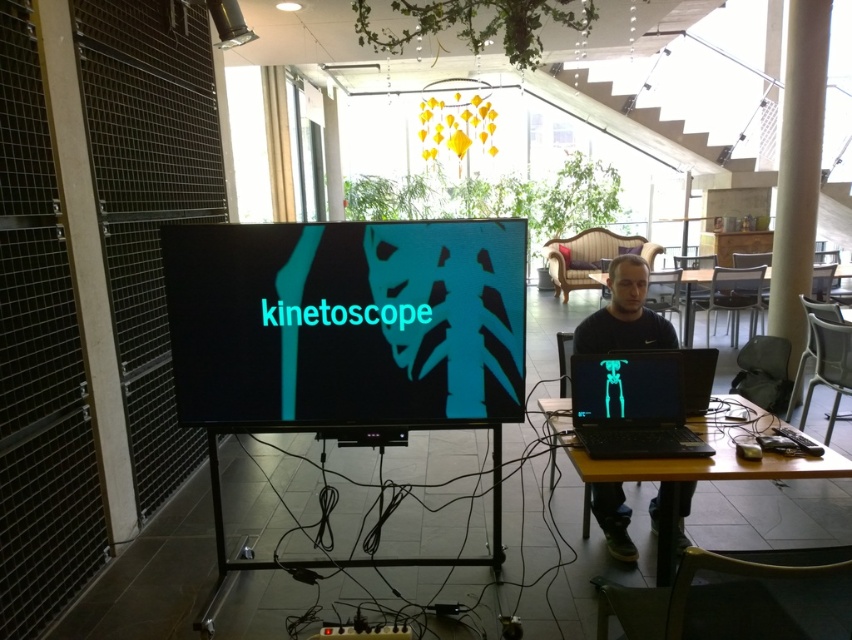
Can you confirm if black glossy laptop at right is thinner than black matte laptop at right?

No, black glossy laptop at right is not thinner than black matte laptop at right.

Who is positioned more to the left, black glossy laptop at right or black matte laptop at right?

From the viewer's perspective, black glossy laptop at right appears more on the left side.

I want to click on black glossy laptop at right, so tap(632, 404).

At what (x,y) coordinates should I click in order to perform the action: click on teal matte screen at center. Please return your answer as a coordinate pair (x, y). The image size is (852, 640). Looking at the image, I should click on (346, 321).

In the scene shown: Is teal matte screen at center above black plastic table at lower right?

Yes, teal matte screen at center is above black plastic table at lower right.

The height and width of the screenshot is (640, 852). Describe the element at coordinates (346, 321) in the screenshot. I see `teal matte screen at center` at that location.

This screenshot has height=640, width=852. Identify the location of teal matte screen at center. (346, 321).

Describe the element at coordinates (689, 461) in the screenshot. I see `black plastic table at lower right` at that location.

Image resolution: width=852 pixels, height=640 pixels. I want to click on black plastic table at lower right, so click(x=689, y=461).